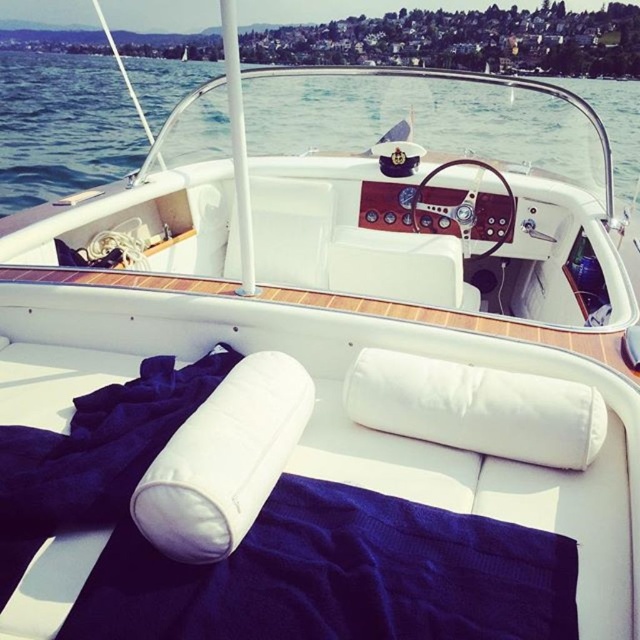
You are a passenger on the boat and want to place your sunglasses on the white fabric pillow at center without them falling into the transparent water at center. Based on their positions, which object should you place them closer to to avoid this?

You should place the sunglasses closer to the white fabric pillow at center because the transparent water at center is to the right of it, so moving towards the pillow keeps them away from the water.

You are a passenger on the boat and want to place a small item on the white fabric pillow at center without it getting wet from the transparent water at center. Is this possible?

The transparent water at center is located above the white fabric pillow at center, so placing the item on the pillow may result in it getting wet from the water above. Choose a different location.